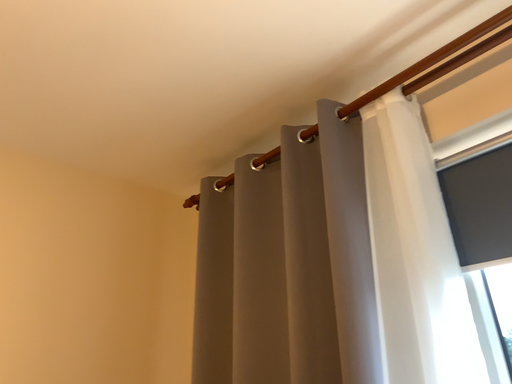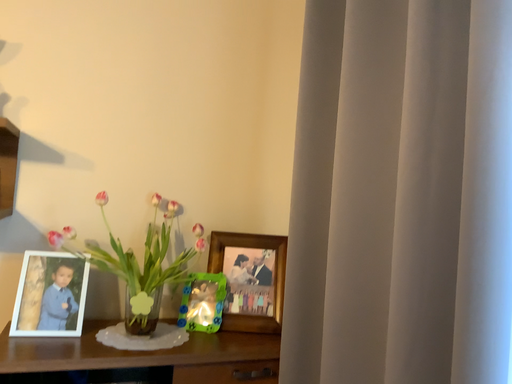
Question: How did the camera likely rotate when shooting the video?

Choices:
 (A) rotated downward
 (B) rotated upward

Answer: (A)